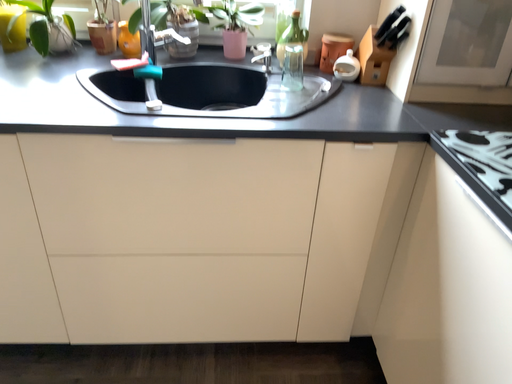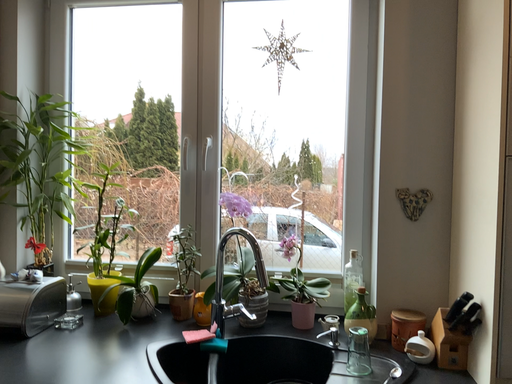
Question: How did the camera likely rotate when shooting the video?

Choices:
 (A) rotated right
 (B) rotated left

Answer: (B)